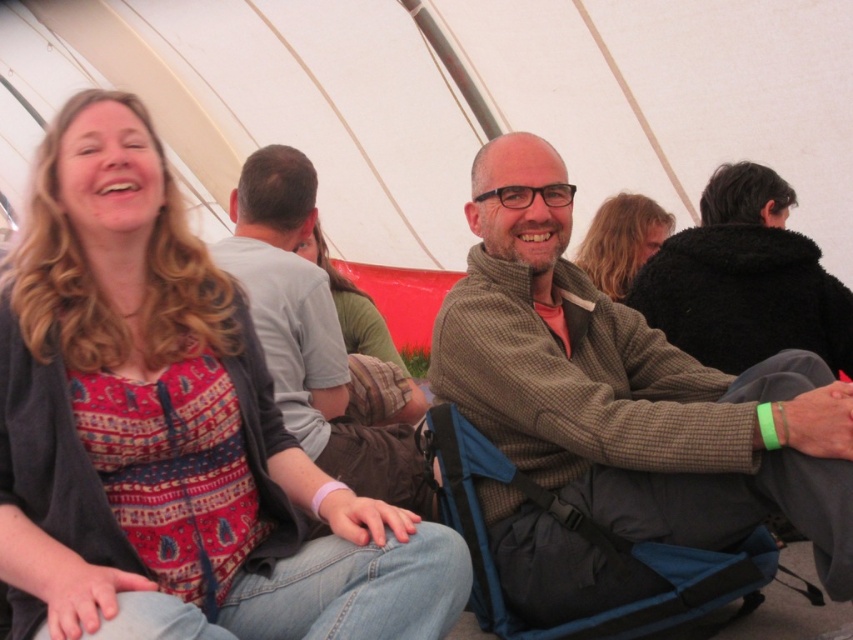
Question: Does black fuzzy coat at upper right have a lesser width compared to blue fabric folding chair at center?

Choices:
 (A) yes
 (B) no

Answer: (A)

Question: Does brown woolen sweater at center come behind gray cotton shirt at center?

Choices:
 (A) yes
 (B) no

Answer: (B)

Question: Among these objects, which one is nearest to the camera?

Choices:
 (A) gray cotton shirt at center
 (B) patterned fabric shirt at upper left
 (C) green textured shirt at center

Answer: (B)

Question: Can you confirm if black fuzzy coat at upper right is smaller than green textured shirt at center?

Choices:
 (A) no
 (B) yes

Answer: (B)

Question: Which point appears farthest from the camera in this image?

Choices:
 (A) (138, 563)
 (B) (640, 548)
 (C) (343, 314)
 (D) (474, 189)

Answer: (C)

Question: Which of the following is the farthest from the observer?

Choices:
 (A) green textured shirt at center
 (B) black fuzzy coat at upper right
 (C) patterned fabric shirt at upper left

Answer: (A)